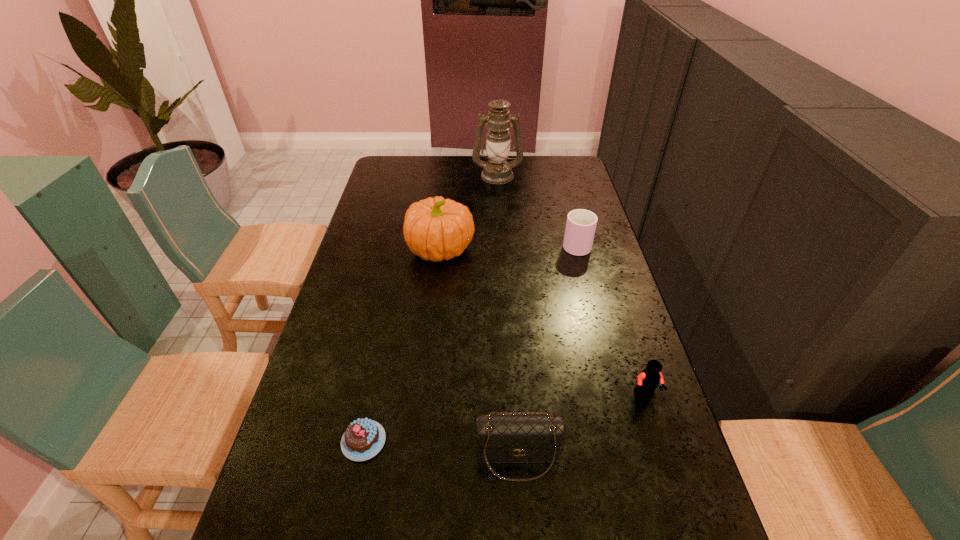
This screenshot has width=960, height=540. What are the coordinates of `the tallest object` in the screenshot? It's located at (497, 170).

Locate an element on the screen. Image resolution: width=960 pixels, height=540 pixels. oil lamp is located at coordinates (497, 170).

Identify the location of the fifth shortest object. The height and width of the screenshot is (540, 960). (435, 228).

Find the location of a particular element. cup is located at coordinates (581, 224).

Where is `clutch bag`? clutch bag is located at coordinates (526, 437).

Locate an element on the screen. This screenshot has height=540, width=960. Lego is located at coordinates (649, 379).

Locate an element on the screen. This screenshot has height=540, width=960. chocolate cake is located at coordinates (364, 438).

Locate an element on the screen. vacant point located on the front of the tallest object is located at coordinates (500, 233).

At what (x,y) coordinates should I click in order to perform the action: click on free space located 0.220m on the surface of the fifth shortest object. Please return your answer as a coordinate pair (x, y). Looking at the image, I should click on (x=541, y=249).

Where is `free spot located 0.280m with the handle on the side of the cup`? Image resolution: width=960 pixels, height=540 pixels. free spot located 0.280m with the handle on the side of the cup is located at coordinates (562, 189).